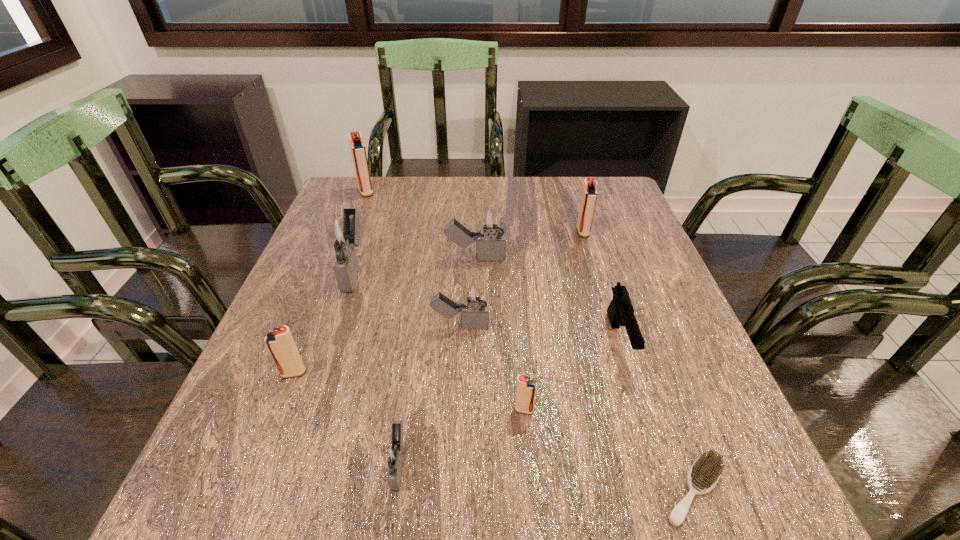
What are the coordinates of `blank region between the sixth farthest igniter and the black pistol` in the screenshot? It's located at (456, 356).

The width and height of the screenshot is (960, 540). In order to click on free spot between the smallest gray igniter and the third smallest red igniter in this screenshot , I will do `click(492, 347)`.

Locate an element on the screen. This screenshot has height=540, width=960. free space between the biggest gray igniter and the third nearest igniter is located at coordinates (324, 321).

At what (x,y) coordinates should I click in order to perform the action: click on empty location between the fourth nearest igniter and the third red igniter from left to right. Please return your answer as a coordinate pair (x, y). Looking at the image, I should click on (492, 368).

Find the location of a particular element. This screenshot has width=960, height=540. free spot between the leftmost gray igniter and the smallest red igniter is located at coordinates (440, 339).

Where is `empty space between the second red igniter from right to left and the black pistol`? This screenshot has height=540, width=960. empty space between the second red igniter from right to left and the black pistol is located at coordinates pyautogui.click(x=571, y=375).

Locate an element on the screen. The height and width of the screenshot is (540, 960). free space between the second smallest gray igniter and the leftmost gray igniter is located at coordinates (408, 298).

Select which object appears as the fifth closest to the fifth igniter from right to left. Please provide its 2D coordinates. Your answer should be formatted as a tuple, i.e. [(x, y)], where the tuple contains the x and y coordinates of a point satisfying the conditions above.

[(705, 472)]

Identify which object is the second nearest to the scrubbing brush. Please provide its 2D coordinates. Your answer should be formatted as a tuple, i.e. [(x, y)], where the tuple contains the x and y coordinates of a point satisfying the conditions above.

[(526, 388)]

Choose which igniter is the fourth nearest neighbor to the third smallest gray igniter. Please provide its 2D coordinates. Your answer should be formatted as a tuple, i.e. [(x, y)], where the tuple contains the x and y coordinates of a point satisfying the conditions above.

[(358, 150)]